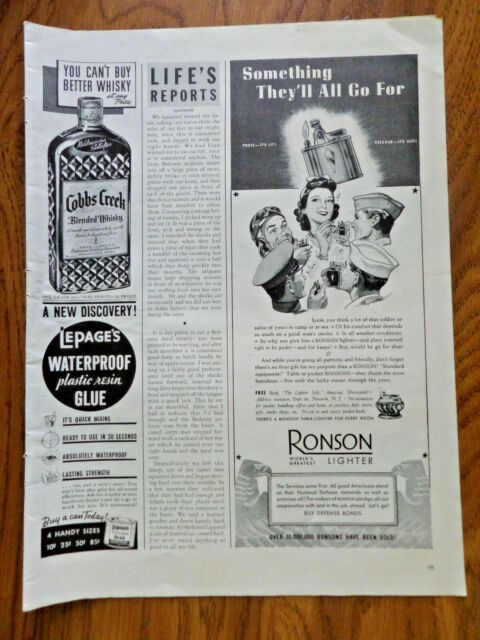
I want to click on bottle, so [93, 164].